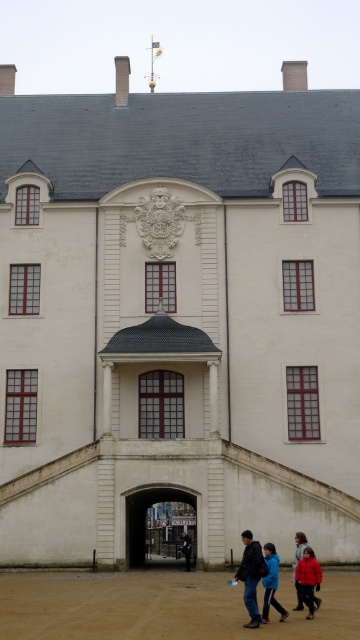
Is red matte jacket at lower right shorter than blue fabric jacket at lower center?

Correct, red matte jacket at lower right is not as tall as blue fabric jacket at lower center.

Which is in front, point (304, 557) or point (266, 602)?

Point (266, 602)

Describe the element at coordinates (308, 579) in the screenshot. I see `red matte jacket at lower right` at that location.

Locate an element on the screen. red matte jacket at lower right is located at coordinates (308, 579).

Does dark blue jeans at lower center have a larger size compared to blue denim jacket at center?

Yes.

Measure the distance from dark blue jeans at lower center to blue denim jacket at center.

dark blue jeans at lower center is 17.21 meters from blue denim jacket at center.

Locate an element on the screen. The image size is (360, 640). dark blue jeans at lower center is located at coordinates (250, 576).

Is dark blue jeans at lower center bigger than blue fabric jacket at lower center?

Yes, dark blue jeans at lower center is bigger than blue fabric jacket at lower center.

This screenshot has width=360, height=640. In order to click on dark blue jeans at lower center in this screenshot , I will do `click(250, 576)`.

Between point (246, 593) and point (275, 554), which one is positioned behind?

Positioned behind is point (275, 554).

This screenshot has height=640, width=360. In order to click on dark blue jeans at lower center in this screenshot , I will do click(250, 576).